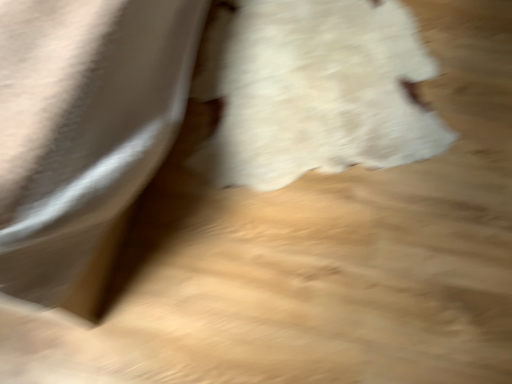
Identify the location of white fluffy dress at center. The height and width of the screenshot is (384, 512). (320, 92).

Measure the distance between point (392, 21) and camera.

Point (392, 21) is 5.20 feet from camera.

The width and height of the screenshot is (512, 384). What do you see at coordinates (320, 92) in the screenshot?
I see `white fluffy dress at center` at bounding box center [320, 92].

The height and width of the screenshot is (384, 512). Find the location of `white fluffy dress at center`. white fluffy dress at center is located at coordinates (x=320, y=92).